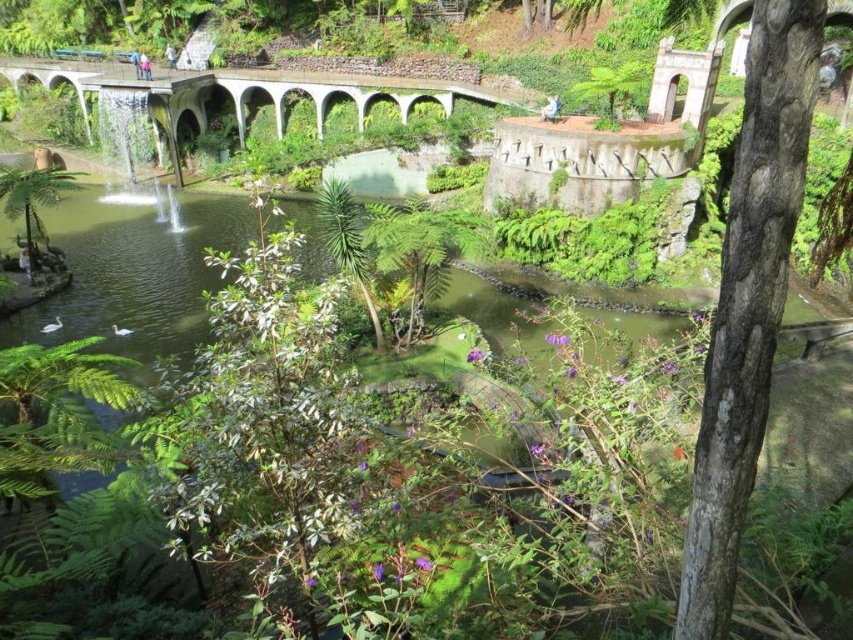
You are standing in the garden and want to take a photo of the green leafy tree at center. If you are currently at position point 0.4, 0.5, which direction should you move to get closer to the tree?

The green leafy tree at center is located at point (264, 422). Since your current position is at (426, 256), you should move towards the northeast direction to get closer to the tree.